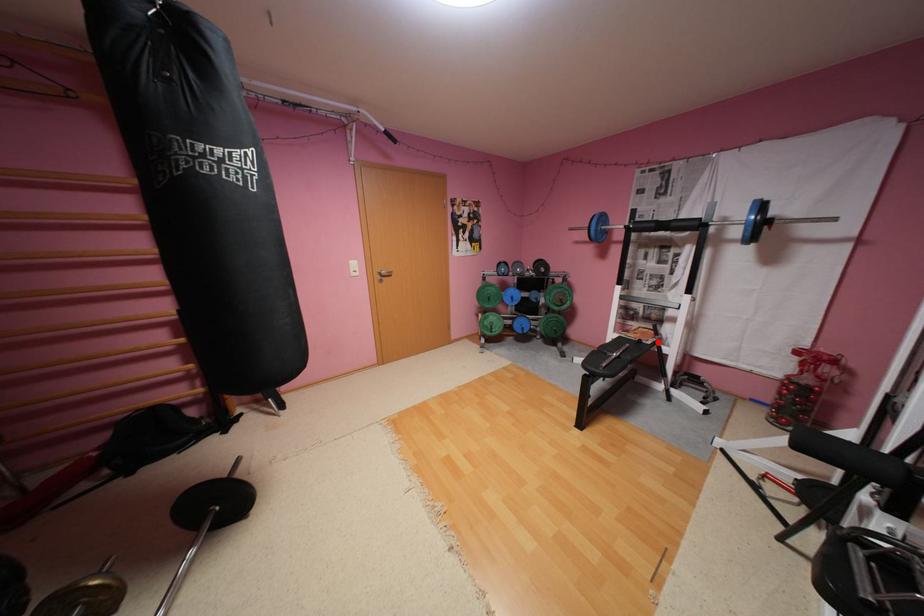
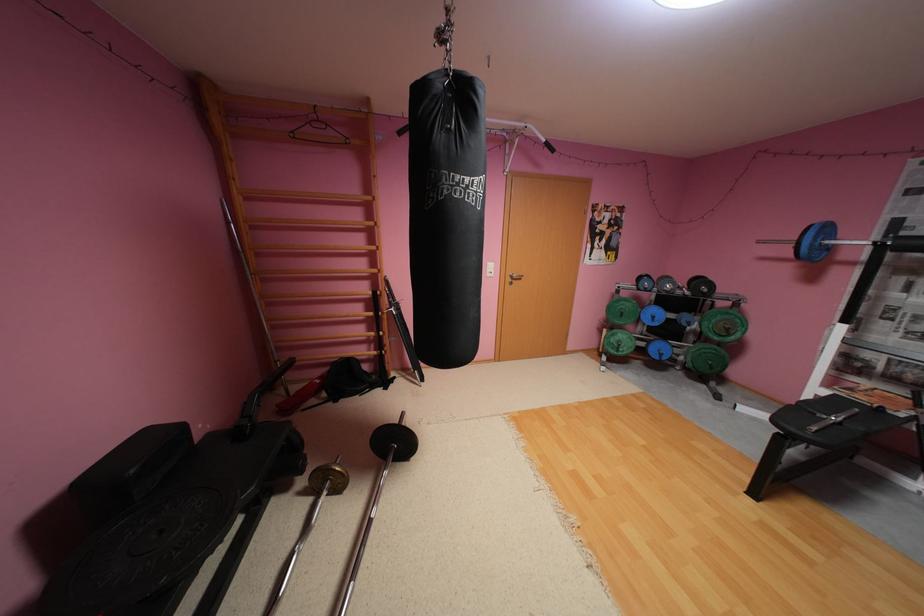
Question: I am providing you with two images of the same scene from different viewpoints. In image1, a red point is highlighted. Considering the same 3D point in image2, which of the following is correct?

Choices:
 (A) It is closer
 (B) It is farther

Answer: (A)